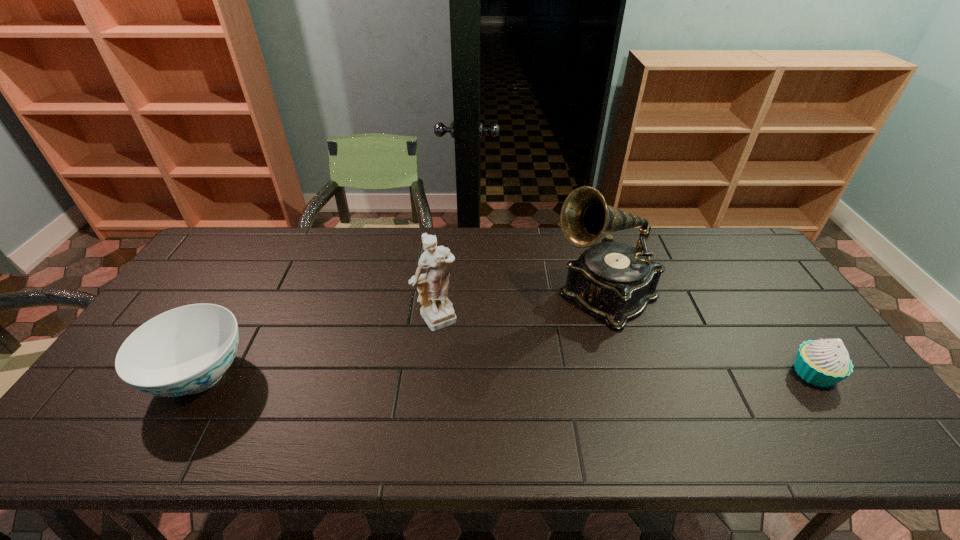
At what (x,y) coordinates should I click in order to perform the action: click on blank space located 0.270m on the front-facing side of the third shortest object. Please return your answer as a coordinate pair (x, y). This screenshot has width=960, height=540. Looking at the image, I should click on (508, 401).

Image resolution: width=960 pixels, height=540 pixels. I want to click on free space located 0.130m on the horn of the tallest object, so click(539, 343).

This screenshot has height=540, width=960. In order to click on free space located 0.350m on the horn of the tallest object in this screenshot , I will do `click(479, 389)`.

Find the location of a particular element. vacant space situated 0.130m on the horn of the tallest object is located at coordinates (539, 343).

The width and height of the screenshot is (960, 540). I want to click on object that is at the far edge, so click(x=614, y=281).

The width and height of the screenshot is (960, 540). I want to click on chinaware at the near edge, so click(x=186, y=350).

At what (x,y) coordinates should I click in order to perform the action: click on cupcake at the near edge. Please return your answer as a coordinate pair (x, y). The height and width of the screenshot is (540, 960). Looking at the image, I should click on (823, 363).

The image size is (960, 540). In order to click on object located at the left edge in this screenshot , I will do `click(186, 350)`.

Where is `object at the right edge`? The width and height of the screenshot is (960, 540). object at the right edge is located at coordinates (823, 363).

Image resolution: width=960 pixels, height=540 pixels. What are the coordinates of `object that is at the near left corner` in the screenshot? It's located at pyautogui.click(x=186, y=350).